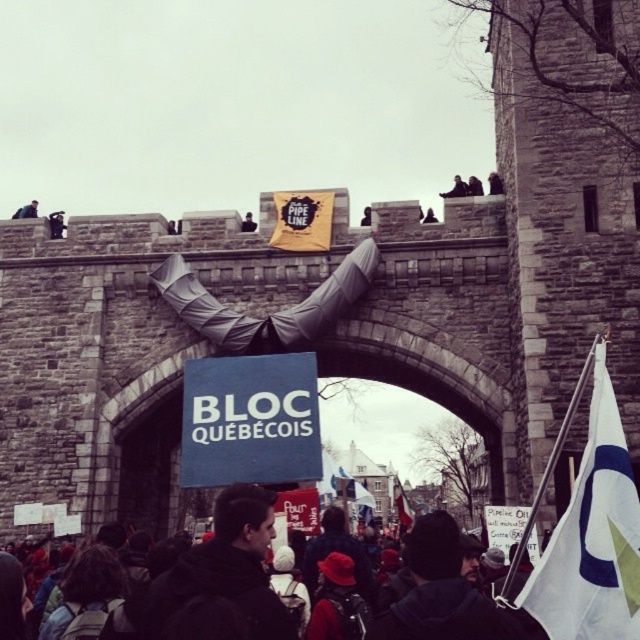
Question: Does dark gray fabric at upper center have a smaller size compared to dark blue jacket at upper left?

Choices:
 (A) no
 (B) yes

Answer: (B)

Question: Which of these objects is positioned farthest from the dark gray fabric at center?

Choices:
 (A) dark gray clothing at lower center
 (B) dark gray fabric at upper center

Answer: (A)

Question: Considering the relative positions of black fabric jacket at lower center and dark gray fabric at upper center in the image provided, where is black fabric jacket at lower center located with respect to dark gray fabric at upper center?

Choices:
 (A) left
 (B) right

Answer: (A)

Question: Does black fabric jacket at lower center appear over white fabric flag at center?

Choices:
 (A) yes
 (B) no

Answer: (A)

Question: Which object is the closest to the dark gray fabric at center?

Choices:
 (A) dark gray clothing at lower center
 (B) black fabric jacket at lower center

Answer: (B)

Question: Among these objects, which one is farthest from the camera?

Choices:
 (A) dark gray fabric at upper center
 (B) dark gray clothing at lower center
 (C) dark blue jacket at upper left
 (D) white fabric flag at center

Answer: (D)